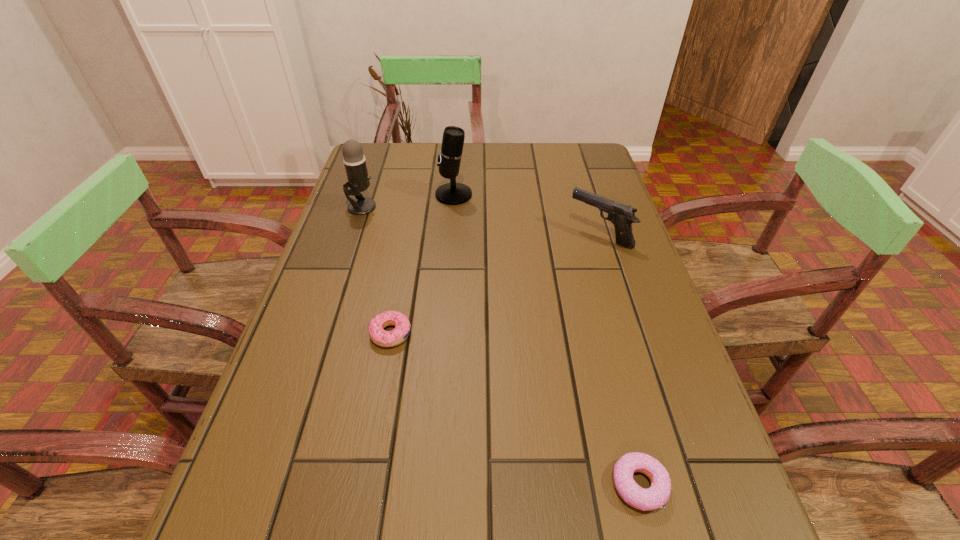
At what (x,y) coordinates should I click in order to perform the action: click on vacant space located at the muzzle of the third farthest object. Please return your answer as a coordinate pair (x, y). Looking at the image, I should click on (485, 235).

The width and height of the screenshot is (960, 540). What are the coordinates of `free region located 0.170m at the muzzle of the third farthest object` in the screenshot? It's located at (504, 235).

Find the location of a particular element. The height and width of the screenshot is (540, 960). vacant space situated at the muzzle of the third farthest object is located at coordinates (454, 235).

Locate an element on the screen. This screenshot has height=540, width=960. blank space located on the left of the left doughnut is located at coordinates click(336, 334).

Locate an element on the screen. This screenshot has width=960, height=540. free space located on the left of the nearer doughnut is located at coordinates (497, 485).

The image size is (960, 540). In order to click on object present at the left edge in this screenshot , I will do `click(358, 179)`.

Locate an element on the screen. The height and width of the screenshot is (540, 960). gun that is at the right edge is located at coordinates (622, 216).

Identify the location of doughnut located at the right edge. The image size is (960, 540). (652, 498).

Image resolution: width=960 pixels, height=540 pixels. In the image, there is a desktop. What are the coordinates of `free space at the far edge` in the screenshot? It's located at (474, 176).

In the image, there is a desktop. Where is `free space at the left edge`? free space at the left edge is located at coordinates (311, 299).